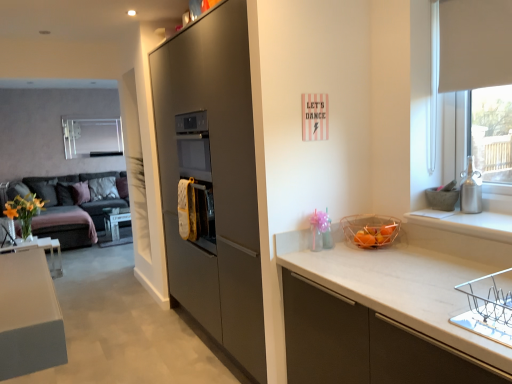
Question: Does white fabric pillow at left, which is the 2th pillow from left to right, contain dark gray fabric couch at left?

Choices:
 (A) yes
 (B) no

Answer: (B)

Question: Is white fabric pillow at left, which is the 2th pillow from left to right, not inside dark gray fabric couch at left?

Choices:
 (A) no
 (B) yes

Answer: (A)

Question: Does white fabric pillow at left, which ranks as the 1th pillow in right-to-left order, appear on the left side of dark gray fabric couch at left?

Choices:
 (A) yes
 (B) no

Answer: (B)

Question: From a real-world perspective, is white fabric pillow at left, which is the 2th pillow from left to right, under dark gray fabric couch at left?

Choices:
 (A) yes
 (B) no

Answer: (B)

Question: Considering the relative sizes of white fabric pillow at left, which is the 2th pillow from left to right, and dark gray fabric couch at left in the image provided, is white fabric pillow at left, which is the 2th pillow from left to right, smaller than dark gray fabric couch at left?

Choices:
 (A) no
 (B) yes

Answer: (B)

Question: Considering the positions of white fabric pillow at left, which ranks as the 1th pillow in right-to-left order, and translucent plastic basket at right in the image, is white fabric pillow at left, which ranks as the 1th pillow in right-to-left order, bigger or smaller than translucent plastic basket at right?

Choices:
 (A) small
 (B) big

Answer: (B)

Question: Would you say white fabric pillow at left, which ranks as the 1th pillow in right-to-left order, is inside or outside translucent plastic basket at right?

Choices:
 (A) inside
 (B) outside

Answer: (B)

Question: From the image's perspective, is white fabric pillow at left, which is the 2th pillow from left to right, above or below translucent plastic basket at right?

Choices:
 (A) below
 (B) above

Answer: (B)

Question: From a real-world perspective, relative to translucent plastic basket at right, is white fabric pillow at left, which is the 2th pillow from left to right, vertically above or below?

Choices:
 (A) above
 (B) below

Answer: (B)

Question: Considering the positions of white fabric pillow at left, which is the 2th pillow from left to right, and dark gray fabric couch at left in the image, is white fabric pillow at left, which is the 2th pillow from left to right, bigger or smaller than dark gray fabric couch at left?

Choices:
 (A) big
 (B) small

Answer: (B)

Question: Choose the correct answer: Is white fabric pillow at left, which is the 2th pillow from left to right, inside dark gray fabric couch at left or outside it?

Choices:
 (A) outside
 (B) inside

Answer: (B)

Question: From their relative heights in the image, would you say white fabric pillow at left, which is the 2th pillow from left to right, is taller or shorter than dark gray fabric couch at left?

Choices:
 (A) short
 (B) tall

Answer: (A)

Question: In the image, is white fabric pillow at left, which ranks as the 1th pillow in right-to-left order, on the left side or the right side of dark gray fabric couch at left?

Choices:
 (A) right
 (B) left

Answer: (A)

Question: Looking at the image, does translucent plastic basket at right seem bigger or smaller compared to yellow matte vase at left?

Choices:
 (A) small
 (B) big

Answer: (A)

Question: Considering the positions of translucent plastic basket at right and yellow matte vase at left in the image, is translucent plastic basket at right wider or thinner than yellow matte vase at left?

Choices:
 (A) wide
 (B) thin

Answer: (B)